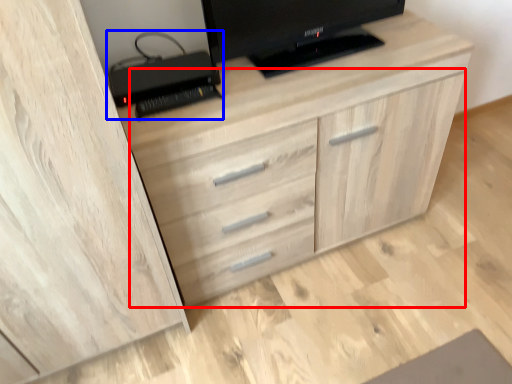
Question: Which point is further to the camera, dresser (highlighted by a red box) or computer (highlighted by a blue box)?

Choices:
 (A) dresser
 (B) computer

Answer: (B)